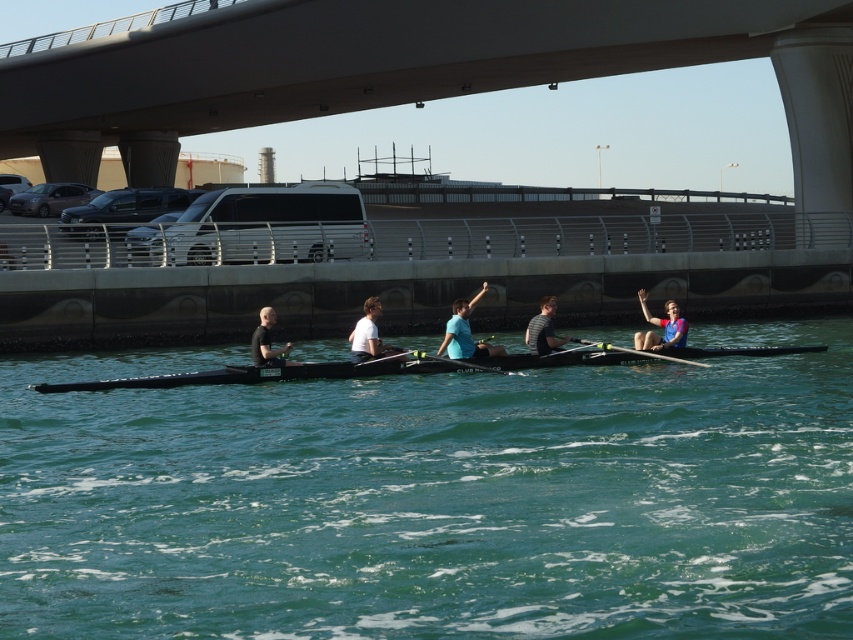
Question: Does green water at center have a lesser width compared to matte blue shirt at center?

Choices:
 (A) yes
 (B) no

Answer: (B)

Question: Observing the image, what is the correct spatial positioning of striped shirt at center in reference to smooth black paddle at center?

Choices:
 (A) above
 (B) below

Answer: (A)

Question: Is the position of green water at center more distant than that of blue fabric rower at right?

Choices:
 (A) no
 (B) yes

Answer: (A)

Question: Which of the following is the farthest from the observer?

Choices:
 (A) green water at center
 (B) rubber paddle at center
 (C) matte blue shirt at center

Answer: (C)

Question: Among these objects, which one is nearest to the camera?

Choices:
 (A) white matte shirt at center
 (B) green water at center
 (C) blue fabric rower at right

Answer: (B)

Question: Which point is farther to the camera?

Choices:
 (A) (376, 326)
 (B) (552, 296)
 (C) (260, 346)

Answer: (B)